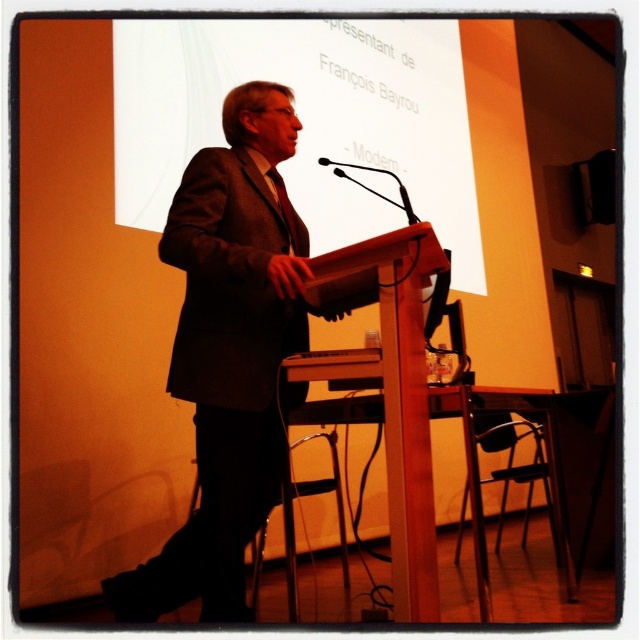
You are an event planner checking the setup for a presentation. You see the white paper at upper center and the black matte microphone at center. Which object is positioned higher in the image?

The white paper at upper center is located above the black matte microphone at center, so it is positioned higher in the image.

Which object is located at the point with coordinates (305, 120)?

The white paper at upper center is located at the point with coordinates (305, 120).